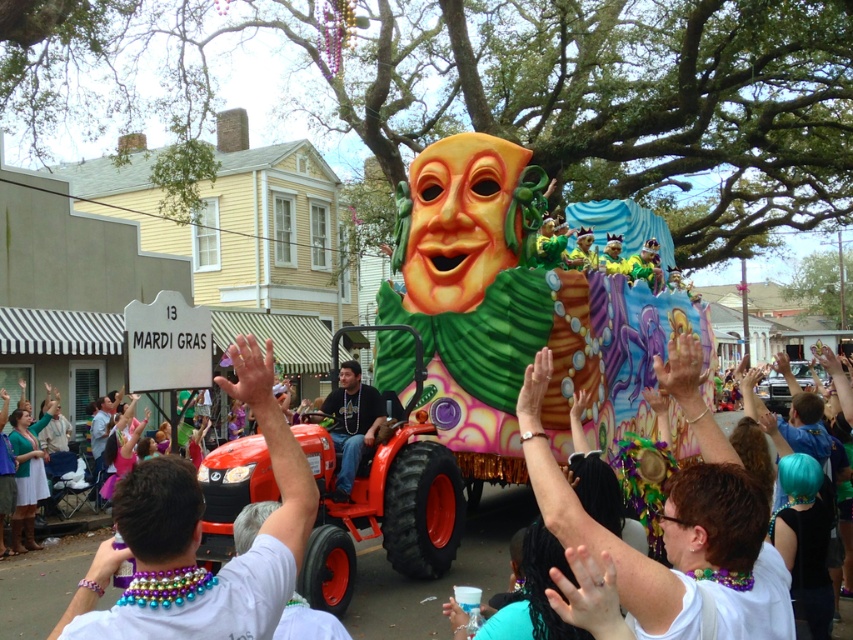
You are a photographer at the Mardi Gras parade. You want to take a photo of the crowd, focusing on the white beaded necklace at center and the matte black shirt at center. From the perspective of someone standing in front of the crowd, which object is positioned to the right?

The white beaded necklace at center is to the right of the matte black shirt at center.

You are a photographer at the Mardi Gras parade. You want to capture a photo of the white beaded necklace at center without the shiny plastic mask at center blocking it. What should you do?

Move the camera downward so that the white beaded necklace at center is visible below the shiny plastic mask at center, which is positioned over it.

You are a photographer standing at the edge of the Mardi Gras parade crowd. You notice the white beaded necklace at center and the matte black shirt at center. Which object do you need to focus on if you want to capture the wider object in your shot?

The white beaded necklace at center is wider than the matte black shirt at center, so you should focus on the white beaded necklace at center to capture the wider object in your shot.